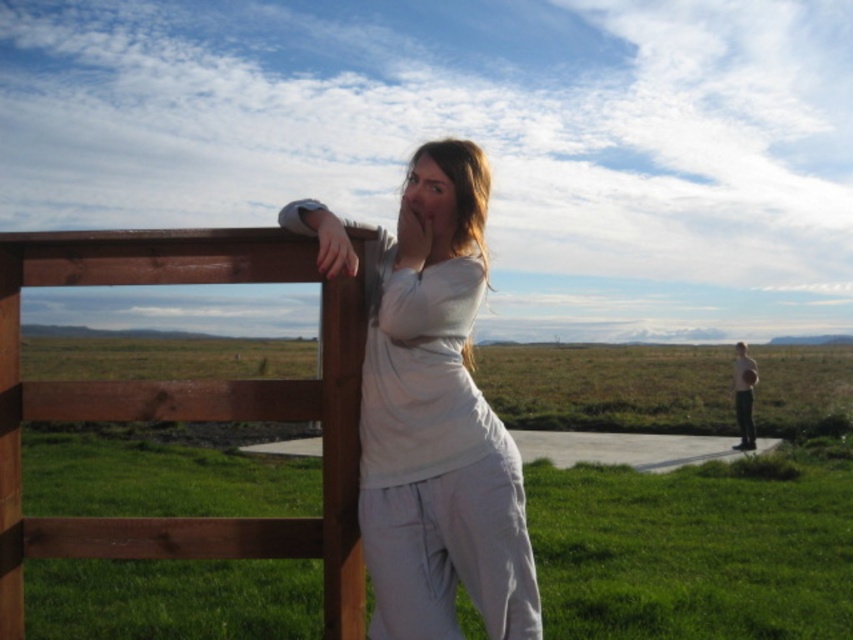
Does green grass at center have a lesser width compared to white cotton shirt at center?

In fact, green grass at center might be wider than white cotton shirt at center.

Which is above, green grass at center or white cotton shirt at center?

white cotton shirt at center

This screenshot has width=853, height=640. I want to click on green grass at center, so click(692, 552).

Is point (439, 452) closer to camera compared to point (735, 392)?

Yes.

Does point (450, 372) come behind point (746, 390)?

No, it is not.

The height and width of the screenshot is (640, 853). Find the location of `white cotton shirt at center`. white cotton shirt at center is located at coordinates (437, 420).

Is brown wooden fence at left behind light brown wooden fence at upper left?

No, it is in front of light brown wooden fence at upper left.

Is brown wooden fence at left taller than light brown wooden fence at upper left?

No.

Which is behind, point (15, 394) or point (741, 429)?

The point (741, 429) is more distant.

This screenshot has width=853, height=640. I want to click on brown wooden fence at left, so click(186, 406).